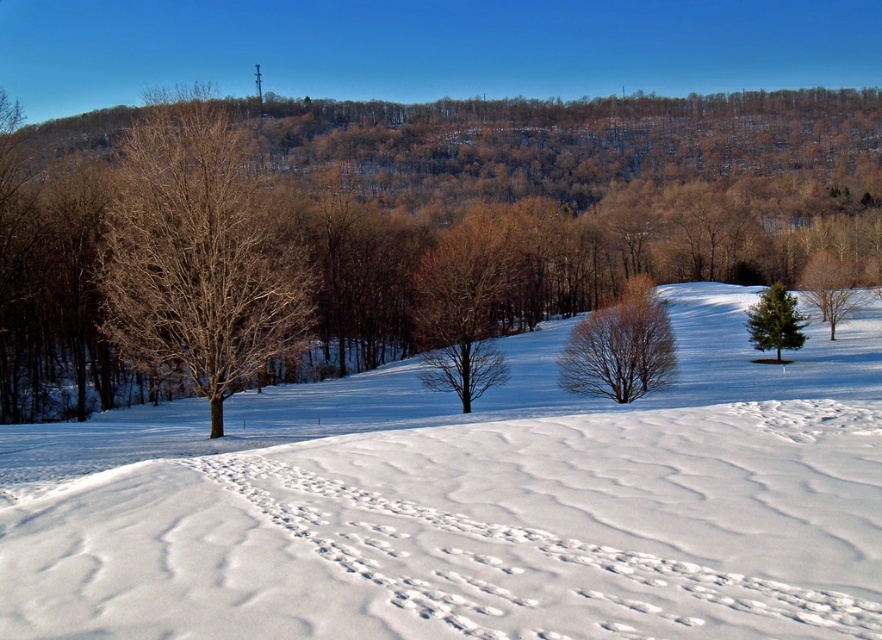
You are an animal tracker observing the winter landscape. You notice the animal tracks leading towards the green textured pine tree at right. Based on the scene, where would you expect the tracks to appear next after passing the white snow at center?

The animal tracks would next appear to the right of the green textured pine tree at right since the white snow at center is located to the left of it, indicating the tracks are moving towards the tree and beyond.

You are an observer standing at the bottom of the snowy hill. You notice two trees in the midground. The first is a green leafy tree at center right, and the second is a green textured pine tree at right. Which tree has a larger width?

The green leafy tree at center right might be wider than green textured pine tree at right.